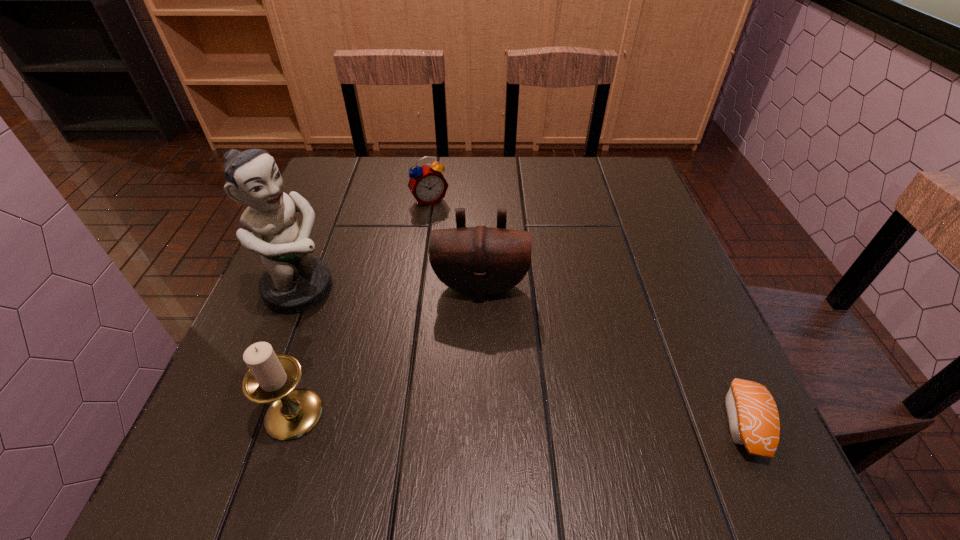
This screenshot has width=960, height=540. Identify the location of free space on the desktop that is between the candle holder and the rightmost object and is positioned on the front-facing side of the second shortest object. (558, 419).

At what (x,y) coordinates should I click in order to perform the action: click on vacant spot on the desktop that is between the candle holder and the shortest object and is positioned with the flap open on the pouch. Please return your answer as a coordinate pair (x, y). Looking at the image, I should click on (475, 417).

Where is `free spot on the desktop that is between the candle holder and the rightmost object and is positioned on the front-facing side of the tallest object`? This screenshot has width=960, height=540. free spot on the desktop that is between the candle holder and the rightmost object and is positioned on the front-facing side of the tallest object is located at coordinates (540, 418).